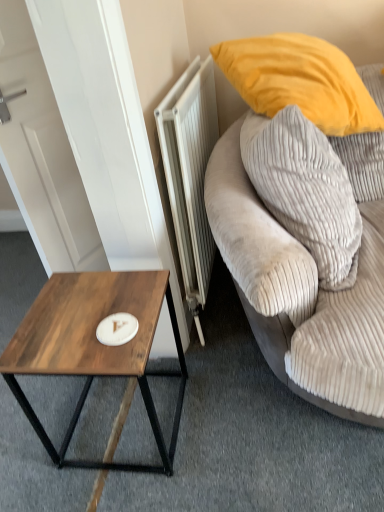
This screenshot has width=384, height=512. Describe the element at coordinates (117, 329) in the screenshot. I see `white matte plate at center` at that location.

Describe the element at coordinates (190, 174) in the screenshot. Image resolution: width=384 pixels, height=512 pixels. I see `white metallic radiator at center` at that location.

Find the location of a particular element. This screenshot has width=384, height=512. white metallic radiator at center is located at coordinates (190, 174).

You are a GUI agent. You are given a task and a screenshot of the screen. Output one action in this format:
    pyautogui.click(x=<x>, y=<y>)
    Task: Click on the wooden coffee table at lower left
    This screenshot has height=512, width=384.
    Given the screenshot: What is the action you would take?
    pyautogui.click(x=94, y=348)

From a real-world perspective, is velvet gray pillow at upper right over velvet grey couch at right?

Indeed, from a real-world perspective, velvet gray pillow at upper right stands above velvet grey couch at right.

Is velvet gray pillow at upper right positioned with its back to velvet grey couch at right?

Correct, velvet gray pillow at upper right is looking away from velvet grey couch at right.

Considering the sizes of velvet gray pillow at upper right and velvet grey couch at right in the image, is velvet gray pillow at upper right wider or thinner than velvet grey couch at right?

Clearly, velvet gray pillow at upper right has less width compared to velvet grey couch at right.

Where is `studio couch located on the right of velvet gray pillow at upper right`? studio couch located on the right of velvet gray pillow at upper right is located at coordinates click(300, 293).

Is wooden coffee table at lower left at the back of velvet grey couch at right?

No, velvet grey couch at right is not facing the opposite direction of wooden coffee table at lower left.

Does velvet grey couch at right have a greater width compared to wooden coffee table at lower left?

Correct, the width of velvet grey couch at right exceeds that of wooden coffee table at lower left.

From the image's perspective, who appears lower, velvet grey couch at right or wooden coffee table at lower left?

wooden coffee table at lower left, from the image's perspective.

In the image, is velvet grey couch at right positioned in front of or behind wooden coffee table at lower left?

velvet grey couch at right is in front of wooden coffee table at lower left.

In terms of width, does wooden coffee table at lower left look wider or thinner when compared to white metallic radiator at center?

wooden coffee table at lower left is wider than white metallic radiator at center.

Are wooden coffee table at lower left and white metallic radiator at center making contact?

No.

Find the location of `radiator above the wooden coffee table at lower left (from a real-world perspective)`. radiator above the wooden coffee table at lower left (from a real-world perspective) is located at coordinates (190, 174).

From the image's perspective, between velvet gray pillow at upper right and wooden coffee table at lower left, who is located below?

wooden coffee table at lower left.

Is there a large distance between velvet gray pillow at upper right and wooden coffee table at lower left?

velvet gray pillow at upper right is near wooden coffee table at lower left, not far away.

Is velvet gray pillow at upper right thinner than wooden coffee table at lower left?

Yes.

Does white metallic radiator at center have a smaller size compared to wooden coffee table at lower left?

No, white metallic radiator at center is not smaller than wooden coffee table at lower left.

How far apart are white metallic radiator at center and wooden coffee table at lower left?

white metallic radiator at center is 42.26 centimeters away from wooden coffee table at lower left.

Can you confirm if white metallic radiator at center is wider than wooden coffee table at lower left?

No, white metallic radiator at center is not wider than wooden coffee table at lower left.

Is white metallic radiator at center far from wooden coffee table at lower left?

That's not correct — white metallic radiator at center is a little close to wooden coffee table at lower left.

From the image's perspective, would you say velvet grey couch at right is shown under velvet gray pillow at upper right?

Yes, from the image's perspective, velvet grey couch at right is below velvet gray pillow at upper right.

Image resolution: width=384 pixels, height=512 pixels. I want to click on pillow that appears on the left of velvet grey couch at right, so click(305, 190).

Is velvet grey couch at right behind velvet gray pillow at upper right?

No, velvet grey couch at right is closer to the viewer.

From a real-world perspective, between velvet grey couch at right and velvet gray pillow at upper right, who is vertically lower?

velvet grey couch at right.

Between velvet grey couch at right and white metallic radiator at center, which one has less height?

With less height is white metallic radiator at center.

From the image's perspective, between velvet grey couch at right and white metallic radiator at center, which one is located above?

white metallic radiator at center is shown above in the image.

Is white metallic radiator at center at the back of velvet grey couch at right?

No, velvet grey couch at right's orientation is not away from white metallic radiator at center.

Can you tell me how much velvet grey couch at right and white metallic radiator at center differ in facing direction?

There is a 78.4-degree angle between the facing directions of velvet grey couch at right and white metallic radiator at center.

Find the location of a particular element. This screenshot has height=512, width=384. pillow above the velvet grey couch at right (from a real-world perspective) is located at coordinates (305, 190).

At what (x,y) coordinates should I click in order to perform the action: click on studio couch that is in front of the wooden coffee table at lower left. Please return your answer as a coordinate pair (x, y). Looking at the image, I should click on (300, 293).

Looking at the image, which one is located closer to wooden coffee table at lower left, white matte plate at center or velvet gray pillow at upper right?

white matte plate at center is closer to wooden coffee table at lower left.

When comparing their distances from wooden coffee table at lower left, does velvet gray pillow at upper right or velvet grey couch at right seem further?

velvet gray pillow at upper right is further to wooden coffee table at lower left.

Which object lies nearer to the anchor point velvet gray pillow at upper right, velvet grey couch at right or white metallic radiator at center?

velvet grey couch at right is closer to velvet gray pillow at upper right.

Looking at the image, which one is located closer to white metallic radiator at center, white matte plate at center or velvet gray pillow at upper right?

Among the two, velvet gray pillow at upper right is located nearer to white metallic radiator at center.

Based on their spatial positions, is white matte plate at center or wooden coffee table at lower left closer to white metallic radiator at center?

wooden coffee table at lower left.

In the scene shown: Estimate the real-world distances between objects in this image. Which object is closer to white metallic radiator at center, velvet gray pillow at upper right or velvet grey couch at right?

Based on the image, velvet grey couch at right appears to be nearer to white metallic radiator at center.

Consider the image. From the image, which object appears to be nearer to white metallic radiator at center, velvet grey couch at right or velvet gray pillow at upper right?

Among the two, velvet grey couch at right is located nearer to white metallic radiator at center.

Estimate the real-world distances between objects in this image. Which object is closer to velvet grey couch at right, white matte plate at center or velvet gray pillow at upper right?

velvet gray pillow at upper right.

At what (x,y) coordinates should I click in order to perform the action: click on plate situated between wooden coffee table at lower left and velvet gray pillow at upper right from left to right. Please return your answer as a coordinate pair (x, y). Looking at the image, I should click on (117, 329).

The image size is (384, 512). Identify the location of pillow between wooden coffee table at lower left and velvet grey couch at right from left to right. (305, 190).

Identify the location of pillow between white metallic radiator at center and wooden coffee table at lower left from top to bottom. pos(305,190).

Find the location of a particular element. The width and height of the screenshot is (384, 512). radiator between white matte plate at center and velvet grey couch at right from left to right is located at coordinates (190, 174).